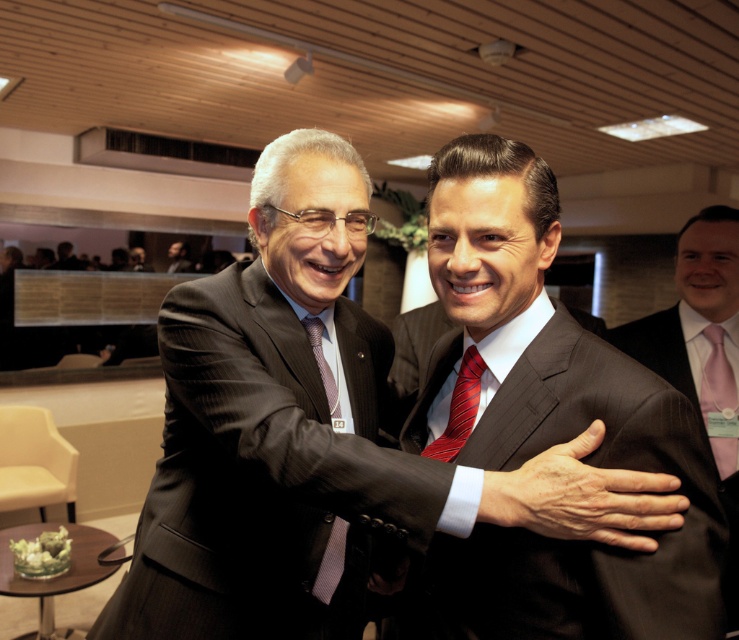
Can you confirm if dark gray pinstripe suit at center is smaller than smooth black suit at center?

Actually, dark gray pinstripe suit at center might be larger than smooth black suit at center.

Where is `dark gray pinstripe suit at center`? Image resolution: width=739 pixels, height=640 pixels. dark gray pinstripe suit at center is located at coordinates (x=265, y=472).

Between point (704, 289) and point (466, 435), which one is positioned behind?

The point (704, 289) is more distant.

Which is in front, point (732, 237) or point (471, 392)?

Point (471, 392) is in front.

At what (x,y) coordinates should I click in order to perform the action: click on pinstriped suit at center. Please return your answer as a coordinate pair (x, y). The width and height of the screenshot is (739, 640). Looking at the image, I should click on (701, 353).

Is dark pinstripe suit at center below smooth black suit at center?

Yes.

From the picture: Can you confirm if dark pinstripe suit at center is wider than smooth black suit at center?

Yes.

Which is in front, point (262, 545) or point (188, 264)?

Point (262, 545)

Where is `dark pinstripe suit at center`? The height and width of the screenshot is (640, 739). dark pinstripe suit at center is located at coordinates (316, 436).